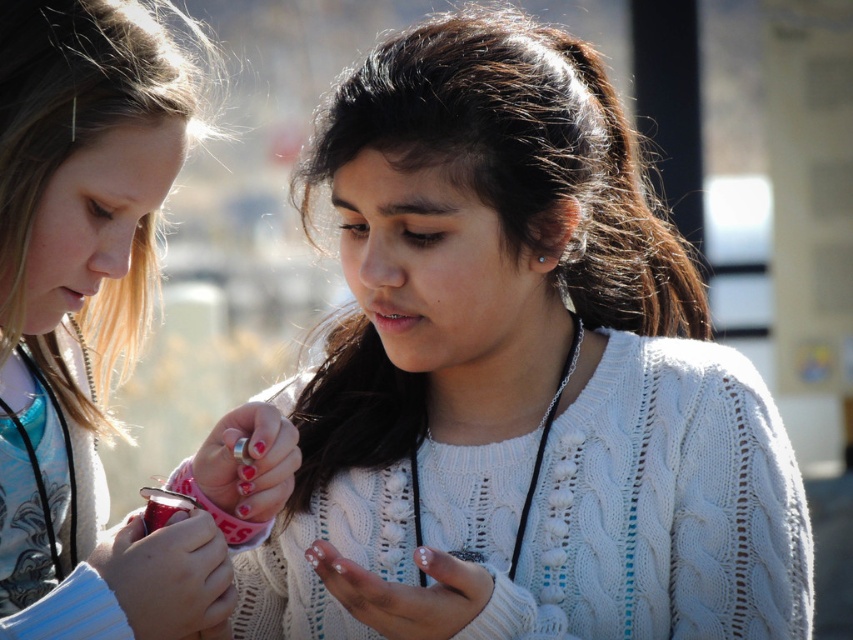
You are standing at the origin of a coordinate system in this image. You see two points marked as point (338,134) and point (51,136). Which point is located behind the other?

Point (338,134) is behind point (51,136).

You are trying to decide which sweater to wear today. You see the white knitted sweater at center and the matte white sweater at center in the image. Which one is bigger?

The white knitted sweater at center is larger in size compared to the matte white sweater at center.